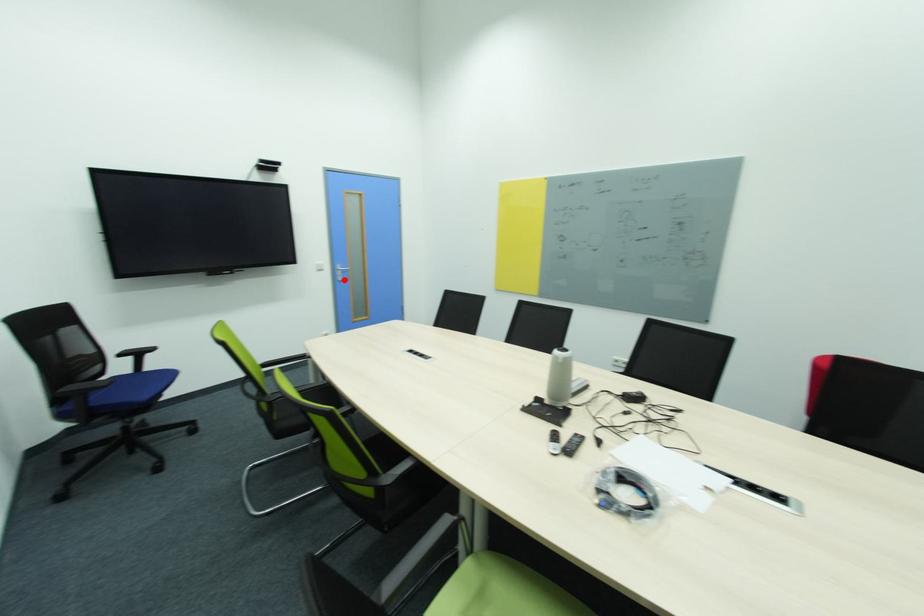
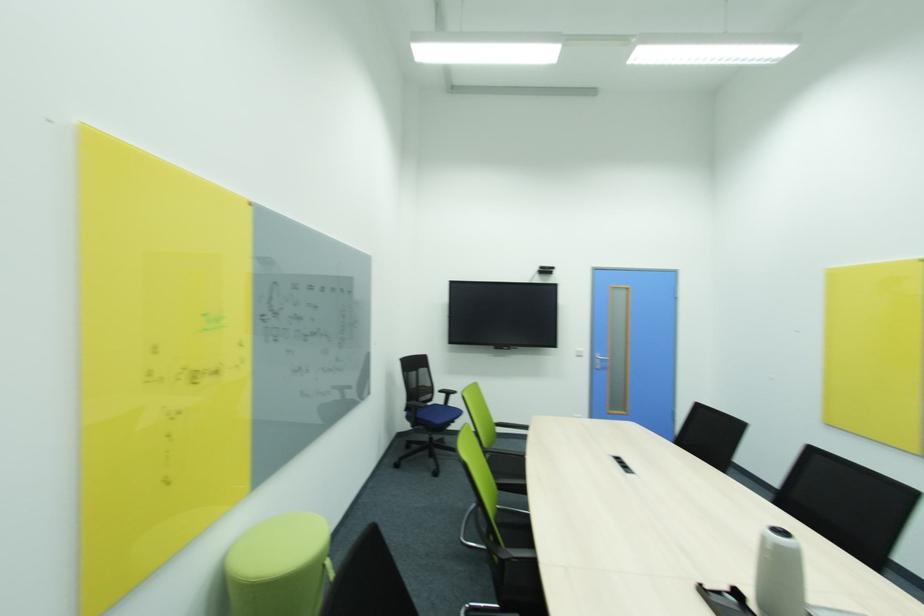
Find the pixel in the second image that matches the highlighted location in the first image.

(602, 368)